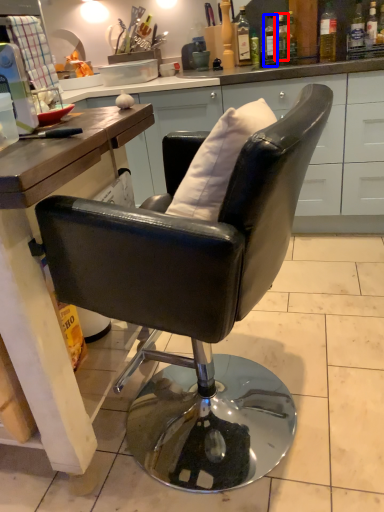
Question: Which point is further to the camera, bottle (highlighted by a red box) or bottle (highlighted by a blue box)?

Choices:
 (A) bottle
 (B) bottle

Answer: (B)